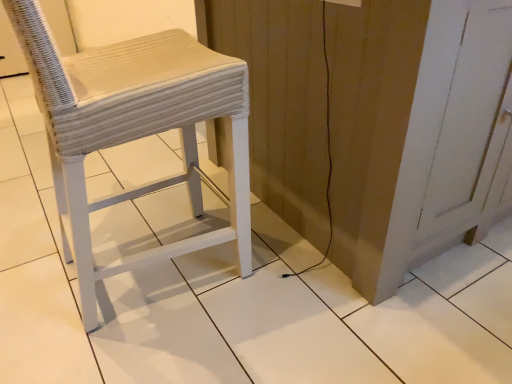
What do you see at coordinates (416, 130) in the screenshot? The height and width of the screenshot is (384, 512). I see `white wood vanity at center` at bounding box center [416, 130].

Where is `white wood vanity at center`? white wood vanity at center is located at coordinates click(416, 130).

Locate an element on the screen. white wood vanity at center is located at coordinates (416, 130).